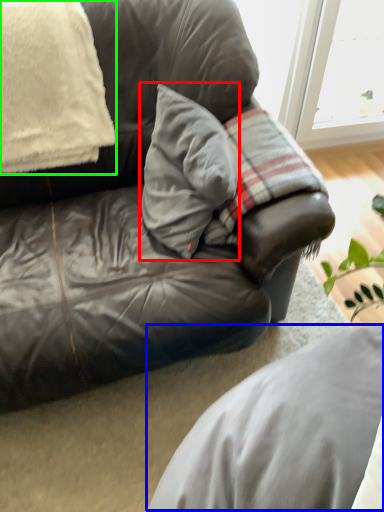
Question: Considering the real-world distances, which object is closest to pillow (highlighted by a red box)? gray (highlighted by a blue box) or pillow (highlighted by a green box).

Choices:
 (A) gray
 (B) pillow

Answer: (B)